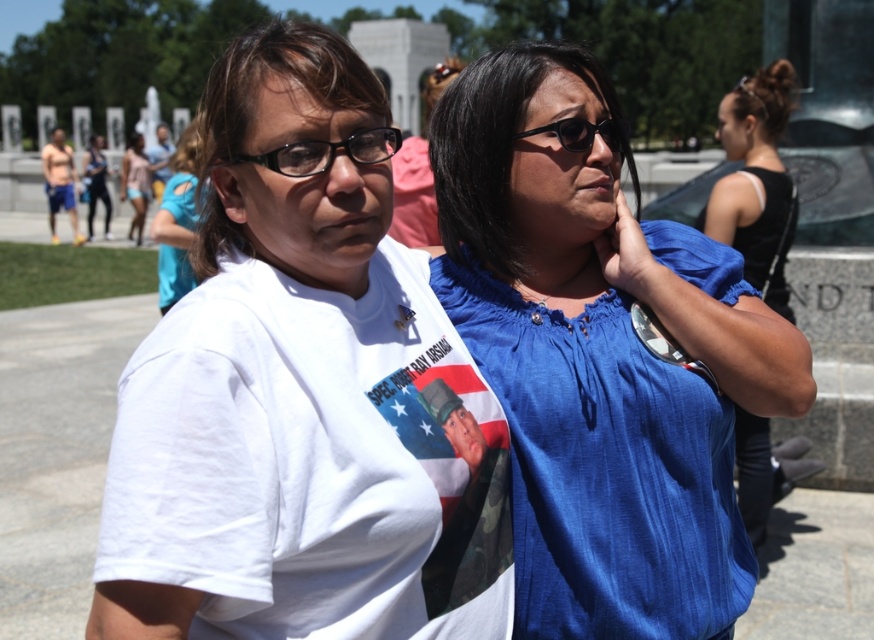
Which is behind, point (274, 164) or point (87, 188)?

The point (87, 188) is behind.

Does point (383, 156) lie in front of point (96, 138)?

That is True.

Image resolution: width=874 pixels, height=640 pixels. In order to click on black plastic glasses at center in this screenshot , I will do `click(325, 152)`.

Is point (670, 381) positioned before point (102, 141)?

Yes, it is in front of point (102, 141).

Can you confirm if blue cotton shirt at center is smaller than matte black leggings at left?

Yes.

Locate an element on the screen. blue cotton shirt at center is located at coordinates (600, 358).

The width and height of the screenshot is (874, 640). In order to click on black plastic glasses at center in this screenshot , I will do `click(325, 152)`.

Is black plastic glasses at center above skinny man at left?

Actually, black plastic glasses at center is below skinny man at left.

Is point (324, 161) more distant than point (68, 198)?

No, (324, 161) is in front of (68, 198).

At what (x,y) coordinates should I click in order to perform the action: click on black plastic glasses at center. Please return your answer as a coordinate pair (x, y). Looking at the image, I should click on (325, 152).